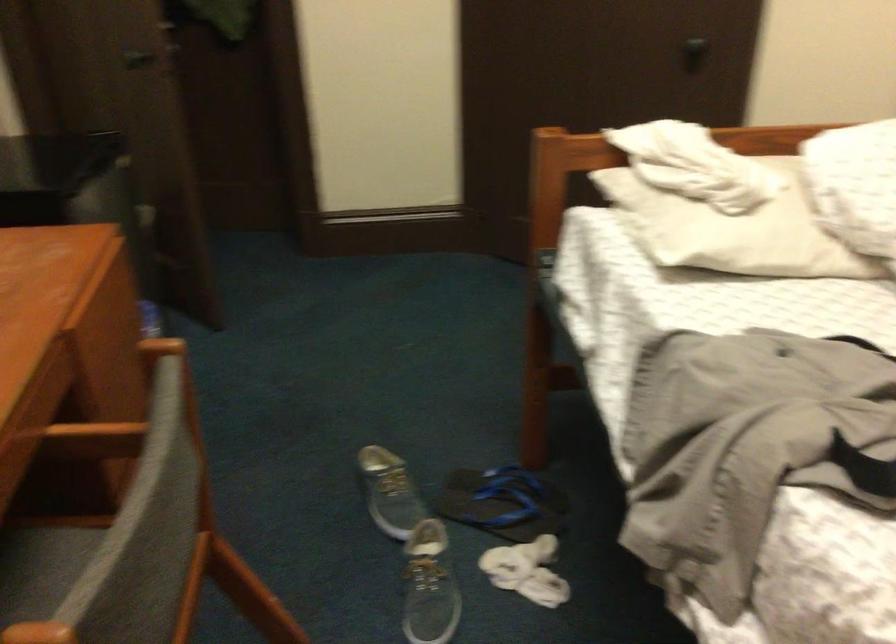
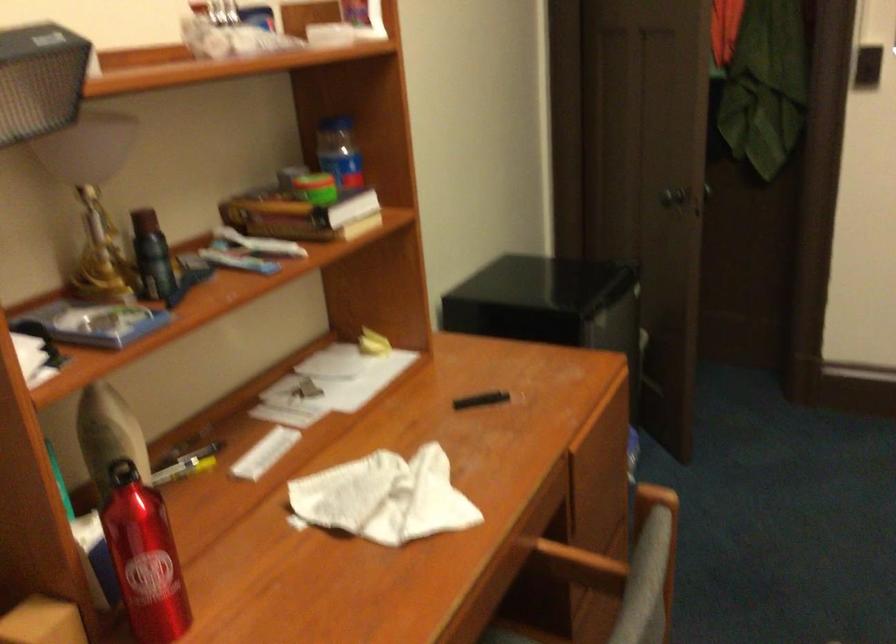
Question: The camera is either moving clockwise (left) or counter-clockwise (right) around the object. The first image is from the beginning of the video and the second image is from the end. Is the camera moving left or right when shooting the video?

Choices:
 (A) Left
 (B) Right

Answer: (B)